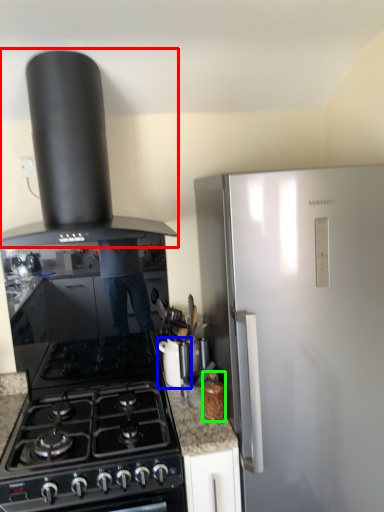
Question: Which object is the closest to the kitchen appliance (highlighted by a red box)? Choose among these: kitchen appliance (highlighted by a blue box) or kitchen appliance (highlighted by a green box).

Choices:
 (A) kitchen appliance
 (B) kitchen appliance

Answer: (A)